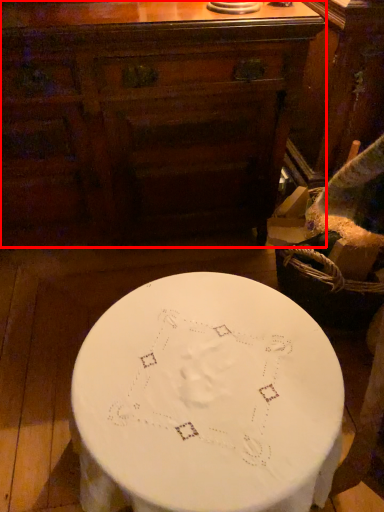
Question: From the image, what is the correct spatial relationship of chest of drawers (annotated by the red box) in relation to table?

Choices:
 (A) right
 (B) left

Answer: (B)